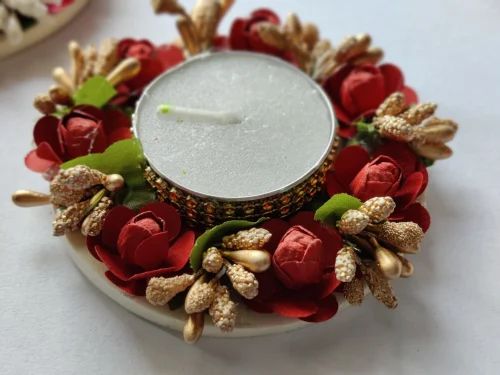
The height and width of the screenshot is (375, 500). Find the location of `gold bulb on far left side`. gold bulb on far left side is located at coordinates point(20,200).